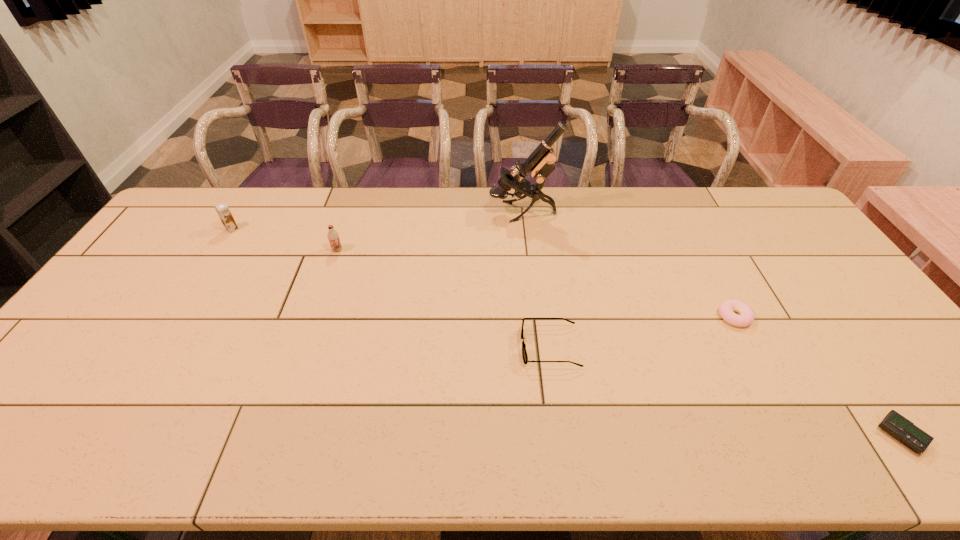
Locate an element on the screen. free space located on the back of the shortest object is located at coordinates (848, 360).

The height and width of the screenshot is (540, 960). What are the coordinates of `microscope that is at the far edge` in the screenshot? It's located at (540, 162).

In order to click on chocolate milk present at the far edge in this screenshot , I will do `click(222, 209)`.

This screenshot has width=960, height=540. What are the coordinates of `object at the near edge` in the screenshot? It's located at (903, 430).

Where is `object that is at the right edge`? object that is at the right edge is located at coordinates (903, 430).

You are a GUI agent. You are given a task and a screenshot of the screen. Output one action in this format:
    pyautogui.click(x=<x>, y=<y>)
    Task: Click on the object that is positioned at the near right corner
    
    Given the screenshot: What is the action you would take?
    pyautogui.click(x=903, y=430)

The height and width of the screenshot is (540, 960). I want to click on vacant space at the far edge of the desktop, so click(x=578, y=218).

Locate an element on the screen. vacant region at the near edge is located at coordinates (583, 457).

Where is `vacant space at the left edge of the desktop`? The height and width of the screenshot is (540, 960). vacant space at the left edge of the desktop is located at coordinates (88, 345).

At what (x,y) coordinates should I click in order to perform the action: click on vacant region at the far right corner of the desktop. Please return your answer as a coordinate pair (x, y). The width and height of the screenshot is (960, 540). Looking at the image, I should click on (740, 193).